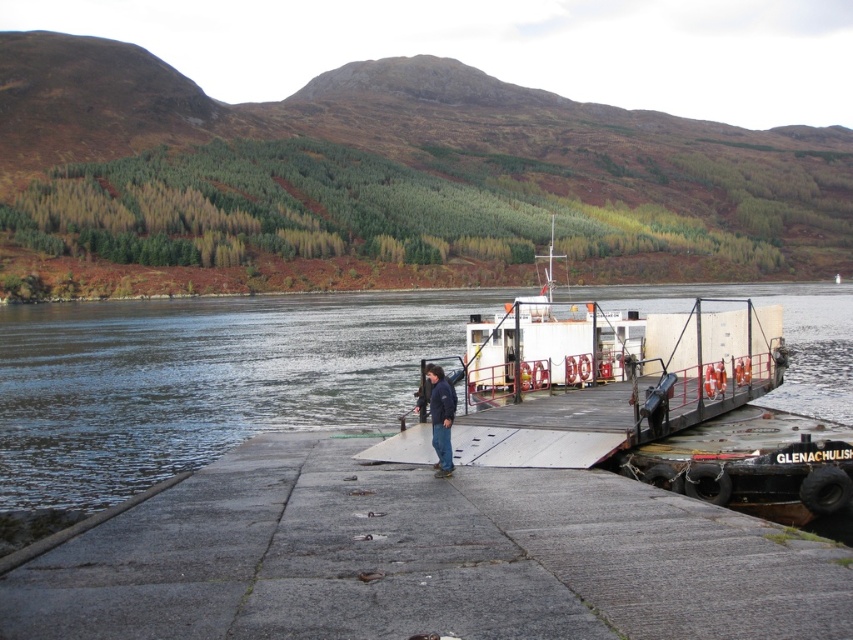
Which of these two, clear water at dock center or dark blue jacket at center, stands taller?

With more height is clear water at dock center.

Can you confirm if clear water at dock center is positioned to the right of dark blue jacket at center?

Yes, clear water at dock center is to the right of dark blue jacket at center.

Identify the location of clear water at dock center. (198, 380).

Does gray concrete dock at center have a lesser width compared to dark blue jacket at center?

In fact, gray concrete dock at center might be wider than dark blue jacket at center.

Does gray concrete dock at center appear on the right side of dark blue jacket at center?

In fact, gray concrete dock at center is to the left of dark blue jacket at center.

Is point (126, 602) in front of point (431, 428)?

Yes, point (126, 602) is closer to viewer.

At what (x,y) coordinates should I click in order to perform the action: click on gray concrete dock at center. Please return your answer as a coordinate pair (x, y). Looking at the image, I should click on (424, 557).

Can you confirm if gray concrete dock at center is thinner than clear water at dock center?

Yes.

Is gray concrete dock at center smaller than clear water at dock center?

Yes.

Which is behind, point (596, 588) or point (167, 440)?

The point (167, 440) is more distant.

Where is `gray concrete dock at center`? The image size is (853, 640). gray concrete dock at center is located at coordinates (424, 557).